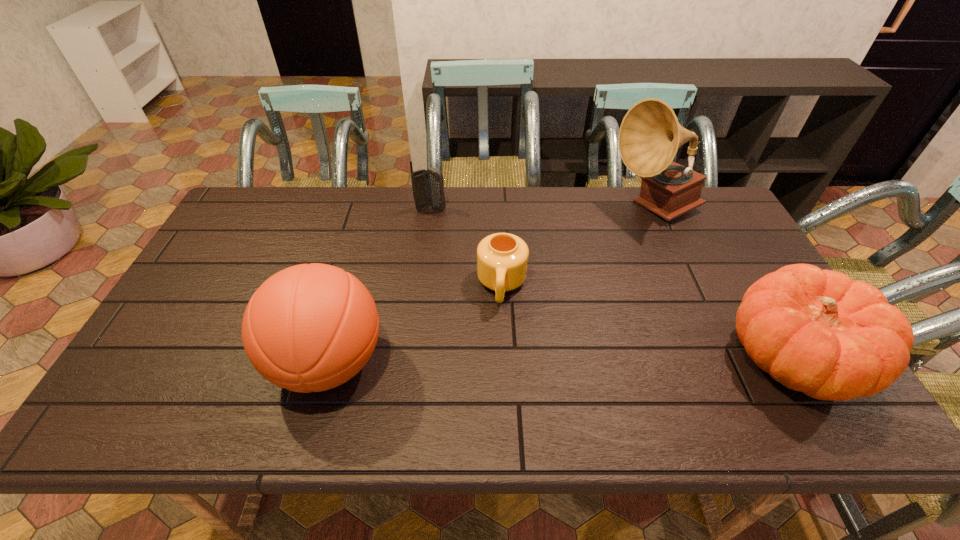
Where is `vacant region located 0.140m on the handle side of the mug`? vacant region located 0.140m on the handle side of the mug is located at coordinates (497, 355).

You are a GUI agent. You are given a task and a screenshot of the screen. Output one action in this format:
    pyautogui.click(x=<x>, y=<y>)
    Task: Click on the blank space located on the handle side of the mug
    This screenshot has height=540, width=960.
    Given the screenshot: What is the action you would take?
    pyautogui.click(x=494, y=388)

Find the location of a particular element. vacant area situated 0.200m on the keyboard of the cellular telephone is located at coordinates (468, 246).

Locate an element on the screen. The height and width of the screenshot is (540, 960). blank space located 0.120m on the keyboard of the cellular telephone is located at coordinates (456, 232).

At what (x,y) coordinates should I click in order to perform the action: click on vacant space situated 0.300m on the keyboard of the cellular telephone. Please return your answer as a coordinate pair (x, y). This screenshot has width=960, height=540. Looking at the image, I should click on (487, 265).

Identify the location of free space located on the horn of the tallest object. The height and width of the screenshot is (540, 960). 600,292.

Locate an element on the screen. This screenshot has width=960, height=540. free space located on the horn of the tallest object is located at coordinates (609, 276).

Where is `vacant space situated 0.180m on the horn of the tallest object`? The width and height of the screenshot is (960, 540). vacant space situated 0.180m on the horn of the tallest object is located at coordinates (617, 262).

Locate an element on the screen. The height and width of the screenshot is (540, 960). cellular telephone at the far edge is located at coordinates (427, 185).

What are the coordinates of `phonograph record located at the far edge` in the screenshot? It's located at (650, 135).